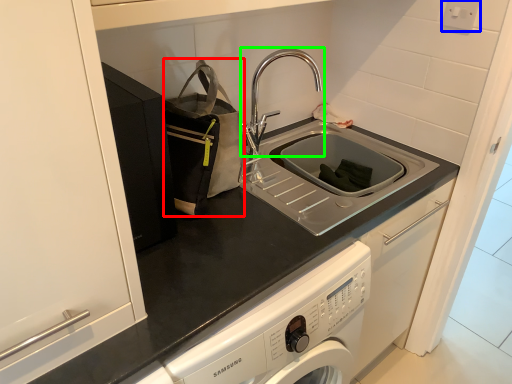
Question: Estimate the real-world distances between objects in this image. Which object is closer to bag (highlighted by a red box), electric outlet (highlighted by a blue box) or tap (highlighted by a green box)?

Choices:
 (A) electric outlet
 (B) tap

Answer: (B)